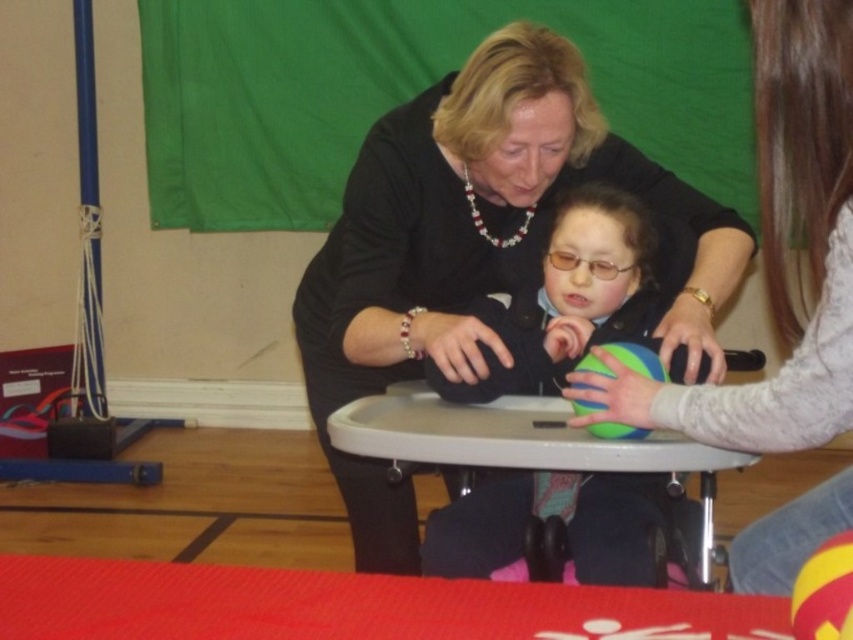
Question: Is matte blue ball at center positioned in front of rubber ball at center?

Choices:
 (A) yes
 (B) no

Answer: (B)

Question: Does matte black sweater at center appear on the right side of rubber ball at center?

Choices:
 (A) no
 (B) yes

Answer: (A)

Question: Which point is closer to the camera?

Choices:
 (A) (799, 115)
 (B) (634, 371)
 (C) (585, 177)
 (D) (608, 524)

Answer: (A)

Question: Which object is positioned closest to the plastic table at center?

Choices:
 (A) rubber ball at center
 (B) matte blue ball at center
 (C) matte black jacket at center
 (D) yellow rubber ball at center

Answer: (A)

Question: Does matte black jacket at center have a larger size compared to matte blue ball at center?

Choices:
 (A) yes
 (B) no

Answer: (B)

Question: Estimate the real-world distances between objects in this image. Which object is closer to the matte black jacket at center?

Choices:
 (A) yellow rubber ball at center
 (B) plastic table at center
 (C) matte black sweater at center
 (D) rubber ball at center

Answer: (D)